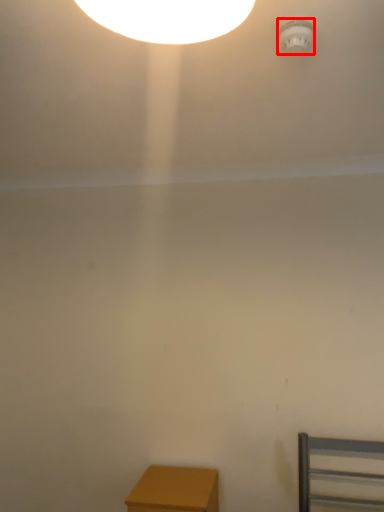
Question: Considering the relative positions of lamp (annotated by the red box) and furniture in the image provided, where is lamp (annotated by the red box) located with respect to the staircase?

Choices:
 (A) right
 (B) left

Answer: (A)